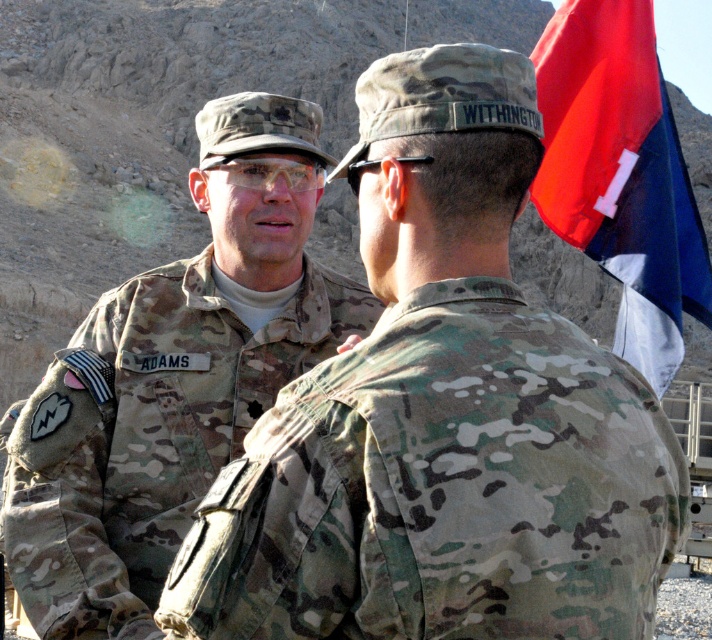
Between camouflage fabric uniform at left and red fabric flag at upper right, which one appears on the right side from the viewer's perspective?

Positioned to the right is red fabric flag at upper right.

Looking at this image, does camouflage fabric uniform at left appear over red fabric flag at upper right?

Actually, camouflage fabric uniform at left is below red fabric flag at upper right.

Where is `camouflage fabric uniform at left`? The image size is (712, 640). camouflage fabric uniform at left is located at coordinates (147, 435).

Is camouflage uniform at left smaller than red fabric flag at upper right?

Correct, camouflage uniform at left occupies less space than red fabric flag at upper right.

How far apart are camouflage uniform at left and red fabric flag at upper right?

camouflage uniform at left and red fabric flag at upper right are 11.31 feet apart from each other.

The height and width of the screenshot is (640, 712). Describe the element at coordinates (441, 416) in the screenshot. I see `camouflage uniform at left` at that location.

The width and height of the screenshot is (712, 640). Identify the location of camouflage uniform at left. (441, 416).

Which is below, camouflage uniform at left or camouflage fabric uniform at left?

camouflage fabric uniform at left is below.

What do you see at coordinates (441, 416) in the screenshot?
I see `camouflage uniform at left` at bounding box center [441, 416].

Is point (525, 605) closer to camera compared to point (214, 337)?

Yes, it is.

Identify the location of camouflage uniform at left. (441, 416).